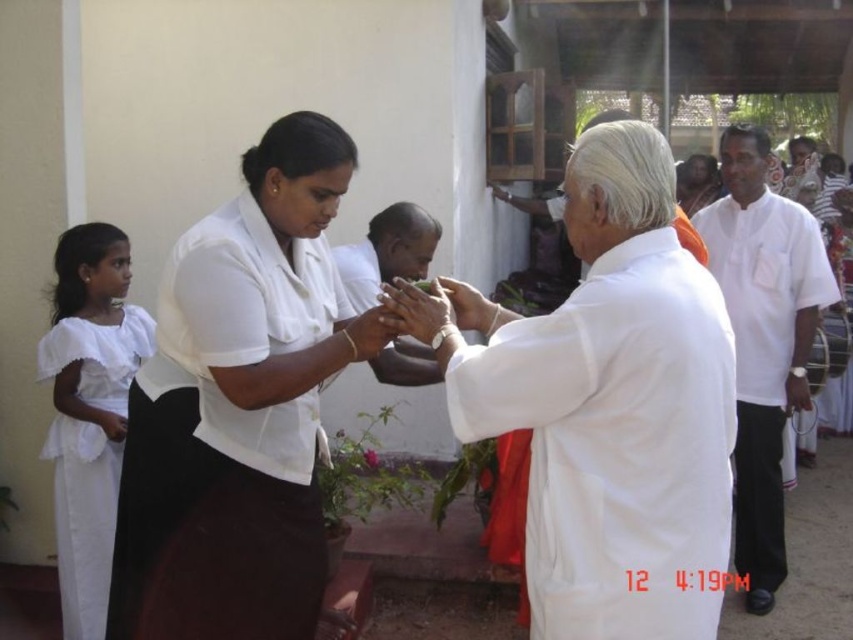
Question: Which object is positioned farthest from the white cotton robe at right?

Choices:
 (A) white satin robe at left
 (B) white cloth at center
 (C) white smooth hand at center
 (D) matte white hands at center

Answer: (A)

Question: Which object is positioned closest to the matte white hands at center?

Choices:
 (A) white cotton robe at right
 (B) white matte dress at center
 (C) white cloth at center

Answer: (C)

Question: Which point is closer to the camera taking this photo?

Choices:
 (A) (79, 524)
 (B) (585, 509)
 (C) (431, 323)
 (D) (364, 316)

Answer: (B)

Question: In this image, where is white matte dress at center located relative to white satin robe at left?

Choices:
 (A) left
 (B) right

Answer: (B)

Question: Is white matte dress at center below matte white hands at center?

Choices:
 (A) no
 (B) yes

Answer: (B)

Question: Can you confirm if white matte dress at center is positioned to the left of white cotton robe at right?

Choices:
 (A) yes
 (B) no

Answer: (A)